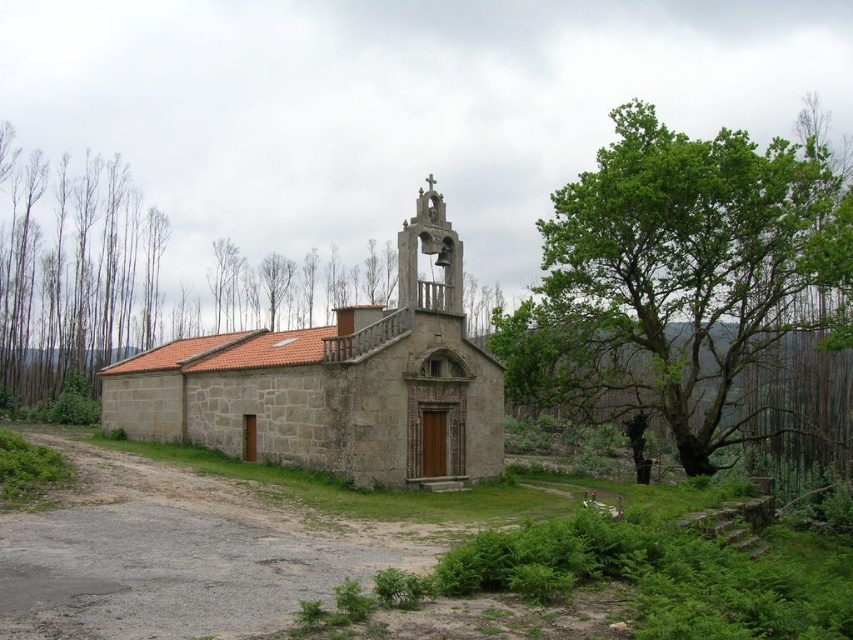
Looking at this image, you are standing in front of the small stone church and notice the green leafy tree at right and the bare wood trees at left. Which group of trees is closer to you?

The green leafy tree at right is closer to you because it is positioned in front of the bare wood trees at left.

You are standing in front of the small stone church and notice two types of trees in the scene. Which group of trees, the green leafy tree at right or the bare wood trees at left, appears closer to the church?

The green leafy tree at right appears closer to the church because it is located above the bare wood trees at left, indicating it is in a more forward position in the scene.

You are standing in front of the church and notice two points marked on the image. The first point is at coordinates point (x=709, y=346) and the second is at point (x=381, y=353). Which point is closer to you?

Point (x=709, y=346) is closer to you because it is further to the viewer than point (x=381, y=353).